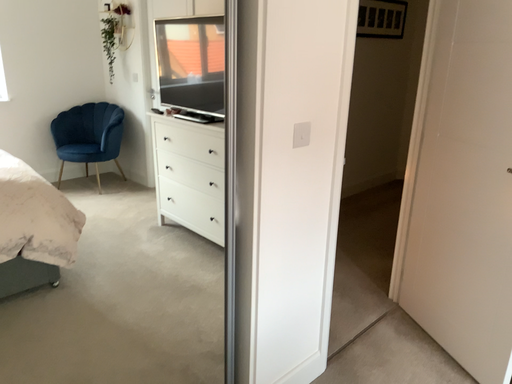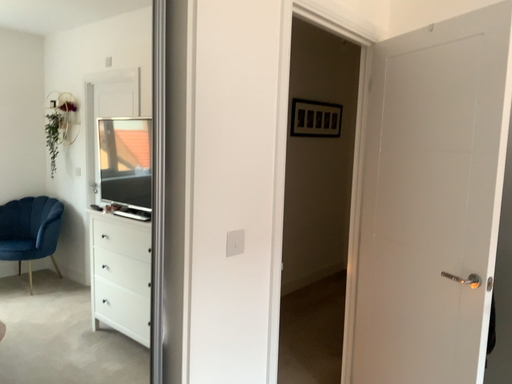
Question: How did the camera likely rotate when shooting the video?

Choices:
 (A) rotated downward
 (B) rotated upward

Answer: (B)